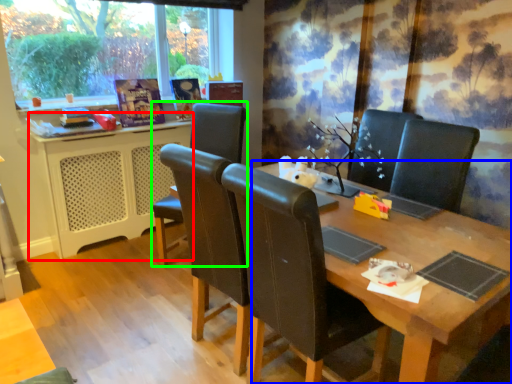
Question: Based on their relative distances, which object is nearer to computer desk (highlighted by a red box)? Choose from table (highlighted by a blue box) and chair (highlighted by a green box).

Choices:
 (A) table
 (B) chair

Answer: (B)